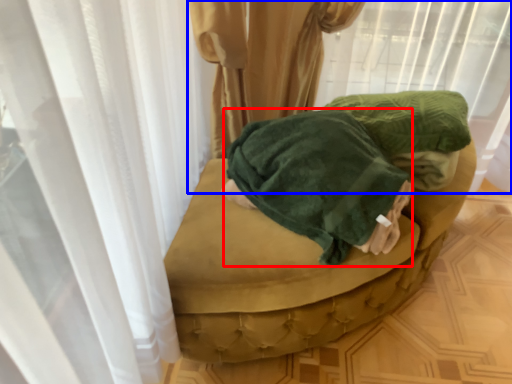
Question: Among these objects, which one is nearest to the camera, clothing (highlighted by a red box) or curtain (highlighted by a blue box)?

Choices:
 (A) clothing
 (B) curtain

Answer: (A)